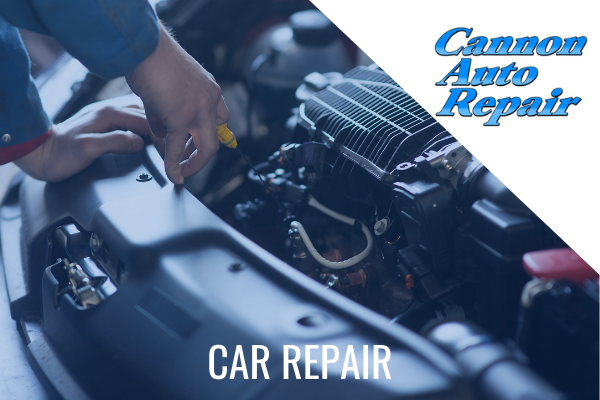
Find the location of a particular element. Image resolution: width=600 pixels, height=400 pixels. screws is located at coordinates (143, 176), (233, 264).